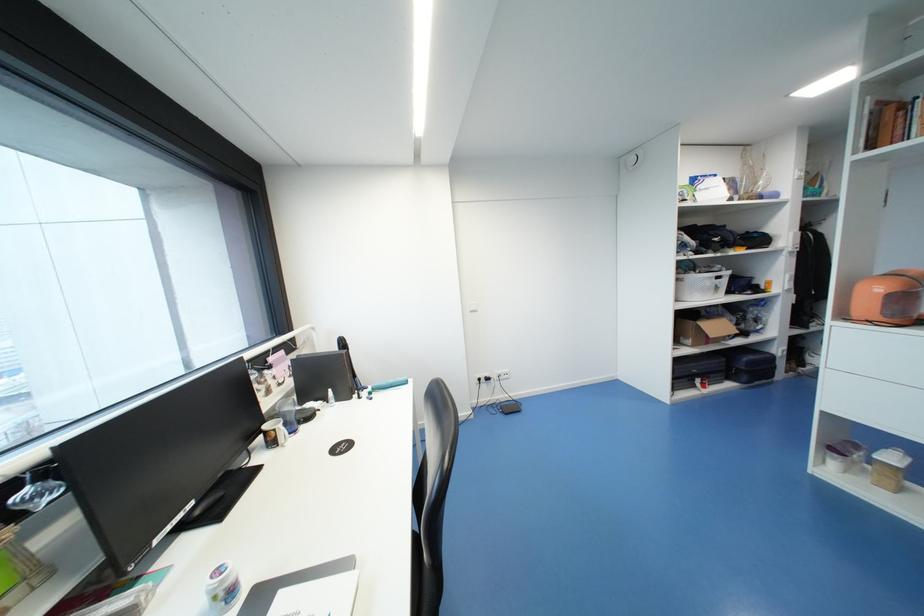
Where would you grasp the white mug handle? Please return your answer as a coordinate pair (x, y).

(288, 429)